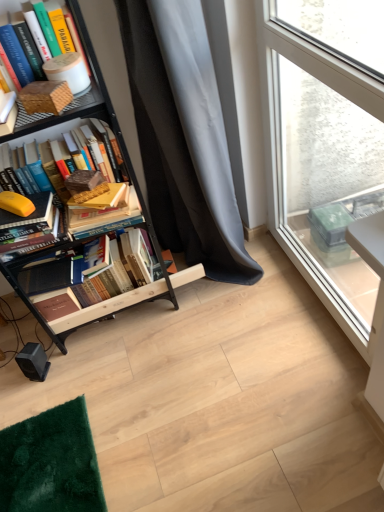
Where is `free location in front of black metal bookcase at left`? This screenshot has height=512, width=384. free location in front of black metal bookcase at left is located at coordinates (125, 382).